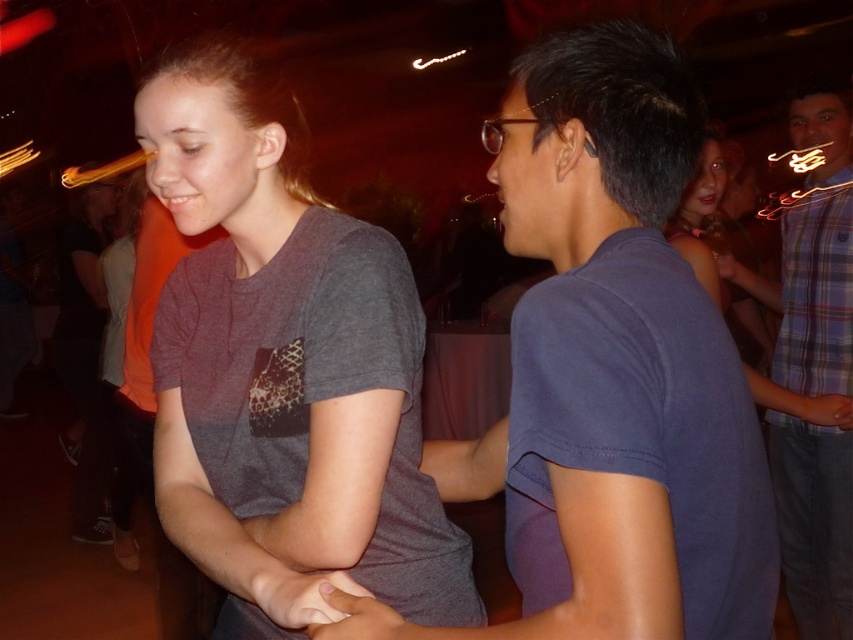
Question: Which point is farther from the camera taking this photo?

Choices:
 (A) (824, 352)
 (B) (253, 276)

Answer: (A)

Question: Among these points, which one is nearest to the camera?

Choices:
 (A) (837, 333)
 (B) (231, 403)

Answer: (B)

Question: Is gray matte t-shirt at center positioned behind plaid shirt at right?

Choices:
 (A) no
 (B) yes

Answer: (A)

Question: Which point appears farthest from the camera in this image?

Choices:
 (A) (263, 131)
 (B) (816, 320)

Answer: (B)

Question: In this image, where is gray matte t-shirt at center located relative to plaid shirt at right?

Choices:
 (A) right
 (B) left

Answer: (B)

Question: Does gray matte t-shirt at center have a smaller size compared to plaid shirt at right?

Choices:
 (A) yes
 (B) no

Answer: (A)